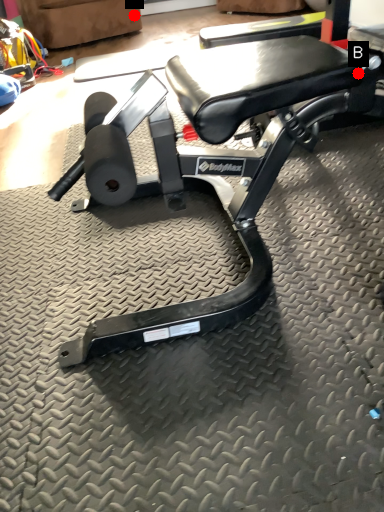
Question: Two points are circled on the image, labeled by A and B beside each circle. Which point appears closest to the camera in this image?

Choices:
 (A) A is closer
 (B) B is closer

Answer: (B)